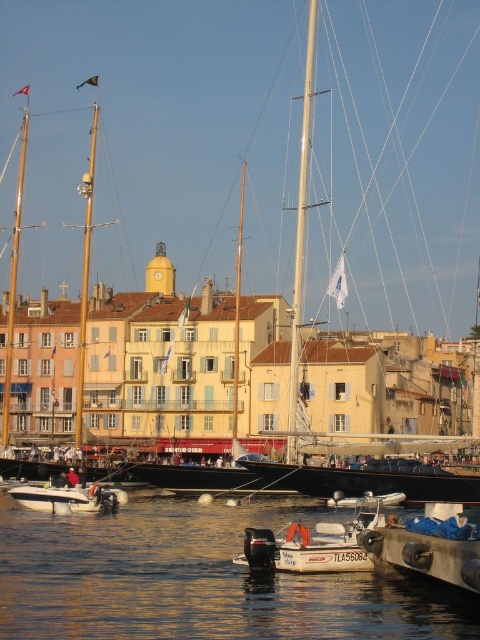
Is point (441, 540) closer to viewer compared to point (61, 484)?

Yes, it is in front of point (61, 484).

Can you confirm if white plastic boat at lower right is smaller than white plastic boat at lower left?

Incorrect, white plastic boat at lower right is not smaller in size than white plastic boat at lower left.

The height and width of the screenshot is (640, 480). What do you see at coordinates (431, 545) in the screenshot?
I see `white plastic boat at lower right` at bounding box center [431, 545].

Find the location of `white plastic boat at lower right`. white plastic boat at lower right is located at coordinates (431, 545).

Is point (291, 321) positioned behind point (27, 486)?

Yes, it is.

Does white matte mast at center have a smaller size compared to white plastic boat at lower left?

Actually, white matte mast at center might be larger than white plastic boat at lower left.

Who is more distant from viewer, (x=305, y=64) or (x=50, y=502)?

Point (x=305, y=64)

Locate an element on the screen. This screenshot has width=480, height=640. white matte mast at center is located at coordinates (300, 237).

How far apart are clear water at lower center and white matte sailboat at upper center?

A distance of 81.56 feet exists between clear water at lower center and white matte sailboat at upper center.

Consider the image. Does clear water at lower center have a larger size compared to white matte sailboat at upper center?

Actually, clear water at lower center might be smaller than white matte sailboat at upper center.

What do you see at coordinates (195, 580) in the screenshot?
I see `clear water at lower center` at bounding box center [195, 580].

You are a GUI agent. You are given a task and a screenshot of the screen. Output one action in this format:
    pyautogui.click(x=<x>, y=<y>)
    Task: Click on the clear water at lower center
    
    Given the screenshot: What is the action you would take?
    tap(195, 580)